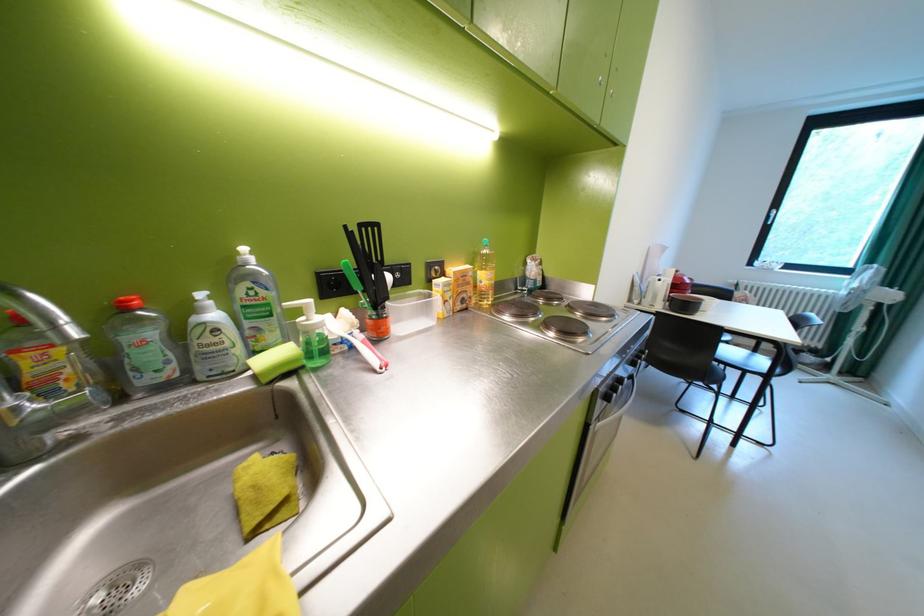
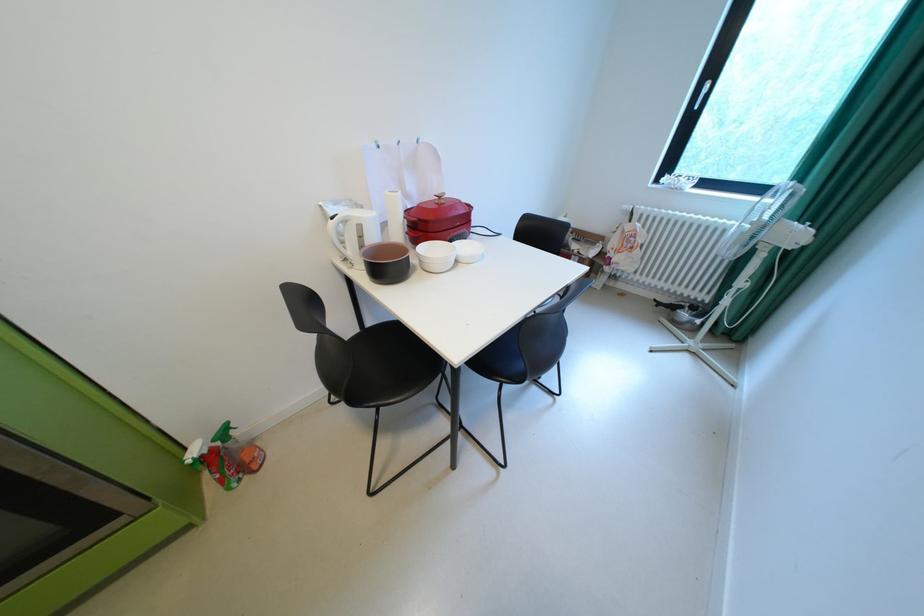
What movement of the cameraman would produce the second image?

The movement direction of the cameraman is right, forward.